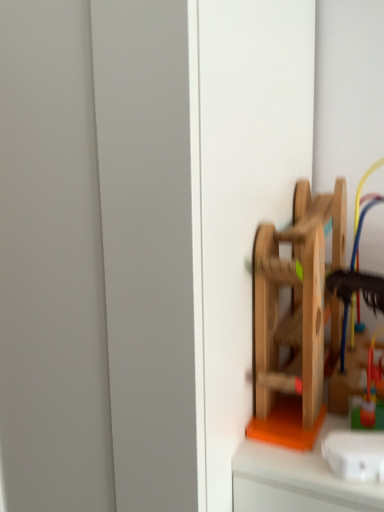
Question: Based on their positions, is wooden toy at right, which is counted as the 2th toy, starting from the back, located to the left or right of rubberized plastic toy at right, the second toy viewed from the front?

Choices:
 (A) left
 (B) right

Answer: (A)

Question: Would you say wooden toy at right, which is counted as the 2th toy, starting from the back, is inside or outside rubberized plastic toy at right, the second toy viewed from the front?

Choices:
 (A) inside
 (B) outside

Answer: (B)

Question: Relative to rubberized plastic toy at right, the second toy viewed from the front, is wooden toy at right, the first toy when ordered from front to back, in front or behind?

Choices:
 (A) behind
 (B) front

Answer: (B)

Question: Does point (369, 391) appear closer or farther from the camera than point (302, 237)?

Choices:
 (A) closer
 (B) farther

Answer: (B)

Question: In terms of size, does rubberized plastic toy at right, acting as the first toy starting from the back, appear bigger or smaller than wooden toy at right, the first toy when ordered from front to back?

Choices:
 (A) big
 (B) small

Answer: (B)

Question: Based on their positions, is rubberized plastic toy at right, acting as the first toy starting from the back, located to the left or right of wooden toy at right, the first toy when ordered from front to back?

Choices:
 (A) right
 (B) left

Answer: (A)

Question: In the image, is rubberized plastic toy at right, acting as the first toy starting from the back, positioned in front of or behind wooden toy at right, which is counted as the 2th toy, starting from the back?

Choices:
 (A) behind
 (B) front

Answer: (A)